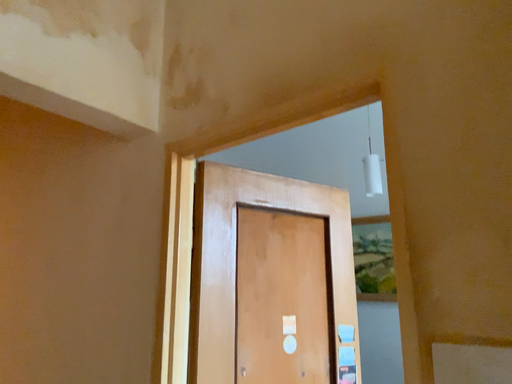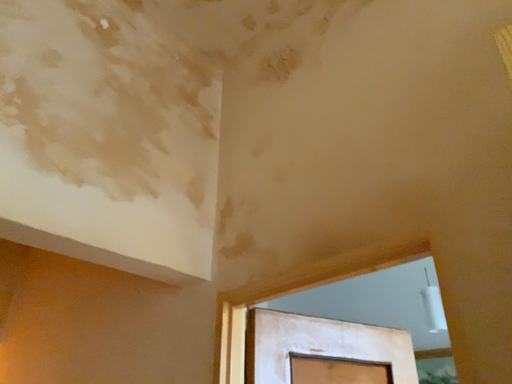
Question: How did the camera likely rotate when shooting the video?

Choices:
 (A) rotated left
 (B) rotated right

Answer: (A)